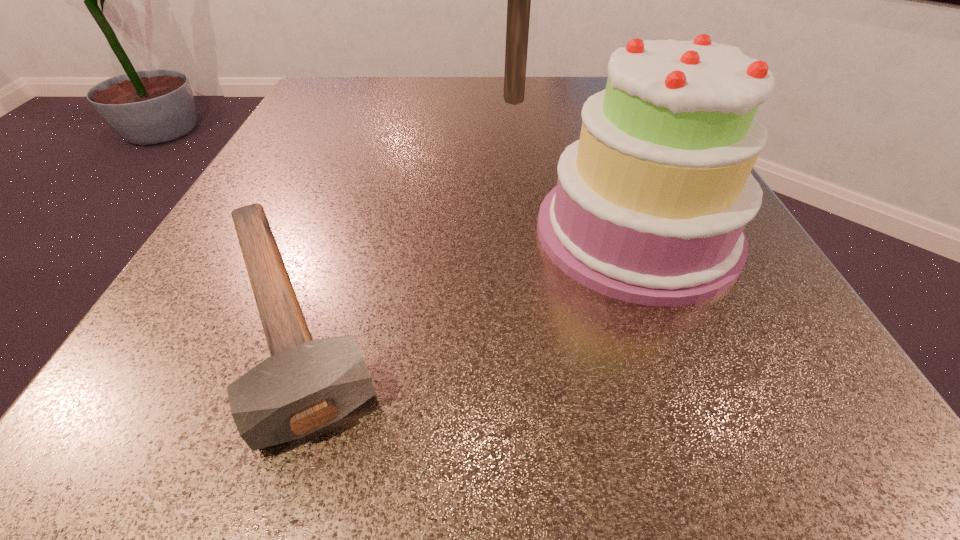
This screenshot has width=960, height=540. What are the coordinates of `free location that satisfies the following two spatial constraints: 1. on the back side of the nearer mallet; 2. on the right side of the cake` in the screenshot? It's located at (325, 232).

I want to click on vacant space that satisfies the following two spatial constraints: 1. on the front side of the cake; 2. on the left side of the taller mallet, so click(530, 232).

Image resolution: width=960 pixels, height=540 pixels. I want to click on free region that satisfies the following two spatial constraints: 1. on the front side of the second shortest object; 2. on the left side of the farther mallet, so click(530, 232).